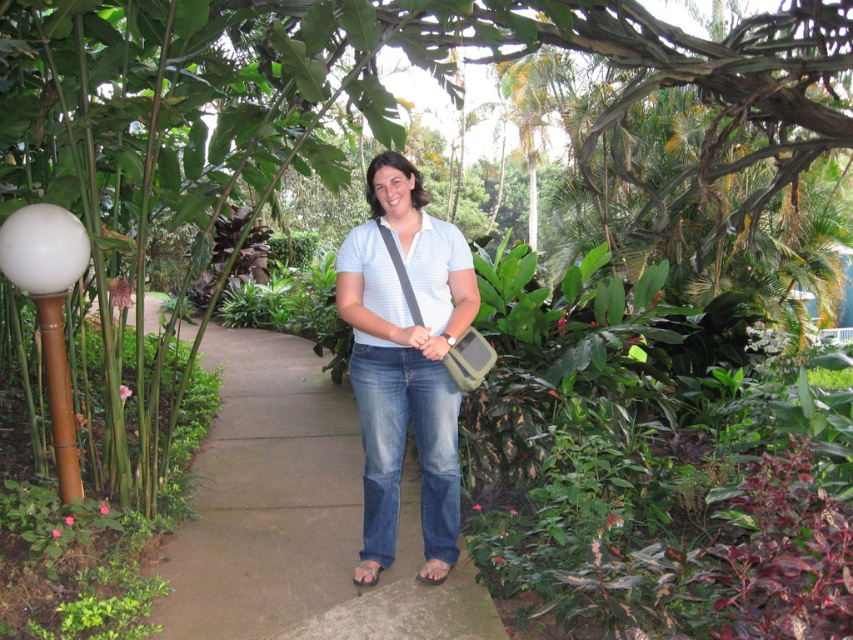
Question: Based on their relative distances, which object is farther from the white striped shirt at center?

Choices:
 (A) white glossy ball at left
 (B) gray concrete pavement at center

Answer: (B)

Question: Is white striped shirt at center to the left of white glossy ball at left from the viewer's perspective?

Choices:
 (A) no
 (B) yes

Answer: (A)

Question: Can you confirm if white striped shirt at center is thinner than white glossy ball at left?

Choices:
 (A) yes
 (B) no

Answer: (B)

Question: Which object is closer to the camera taking this photo?

Choices:
 (A) gray concrete pavement at center
 (B) white glossy ball at left

Answer: (B)

Question: Is gray concrete pavement at center wider than white glossy ball at left?

Choices:
 (A) no
 (B) yes

Answer: (B)

Question: Which is farther from the white striped shirt at center?

Choices:
 (A) white glossy ball at left
 (B) gray concrete pavement at center

Answer: (B)